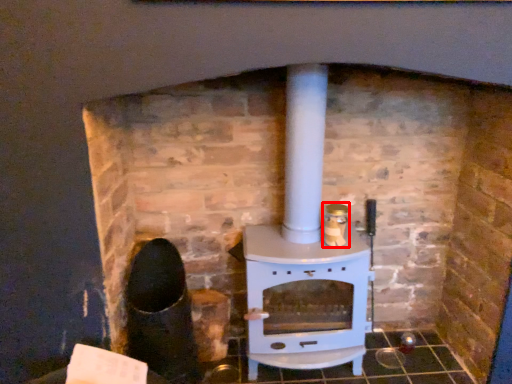
Question: From the image, what is the correct spatial relationship of appliance (annotated by the red box) in relation to wood burning stove?

Choices:
 (A) right
 (B) left

Answer: (A)